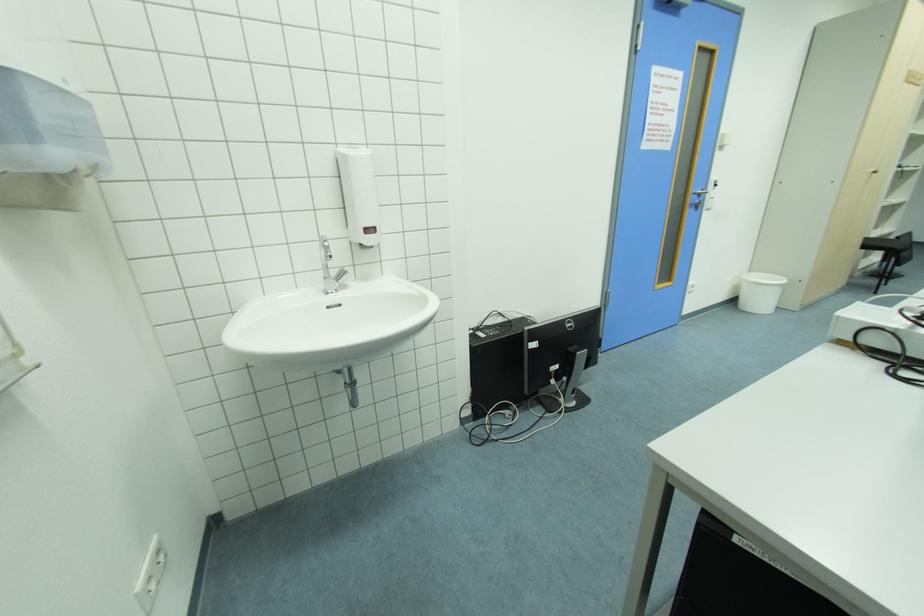
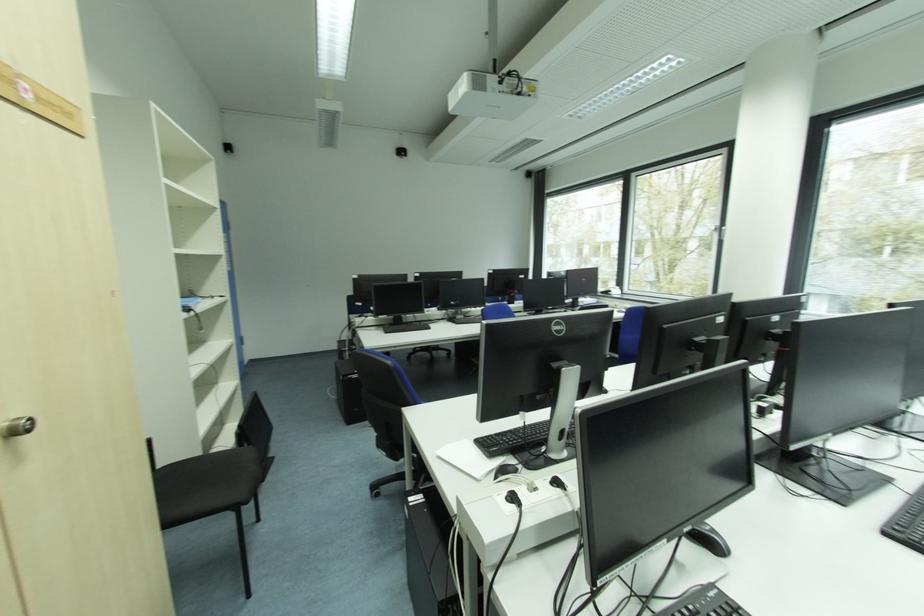
In the second image, find the point that corresponds to [878,172] in the first image.

(6, 424)